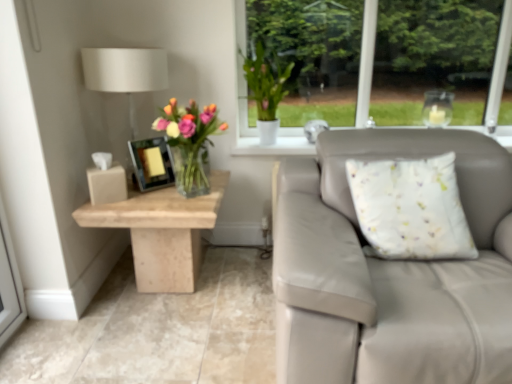
Question: From their relative heights in the image, would you say white fabric lampshade at upper left is taller or shorter than white matte vase at upper center?

Choices:
 (A) tall
 (B) short

Answer: (A)

Question: Looking at their shapes, would you say white fabric lampshade at upper left is wider or thinner than white matte vase at upper center?

Choices:
 (A) thin
 (B) wide

Answer: (B)

Question: Which object is positioned closest to the translucent glass vase at center?

Choices:
 (A) matte black picture frame at center
 (B) beige marble table at left
 (C) white matte vase at upper center
 (D) white fabric cushion at right
 (E) white fabric lampshade at upper left

Answer: (A)

Question: Which is farther from the matte black picture frame at center?

Choices:
 (A) white fabric lampshade at upper left
 (B) white matte vase at upper center
 (C) beige marble table at left
 (D) white fabric cushion at right
 (E) translucent glass vase at center

Answer: (D)